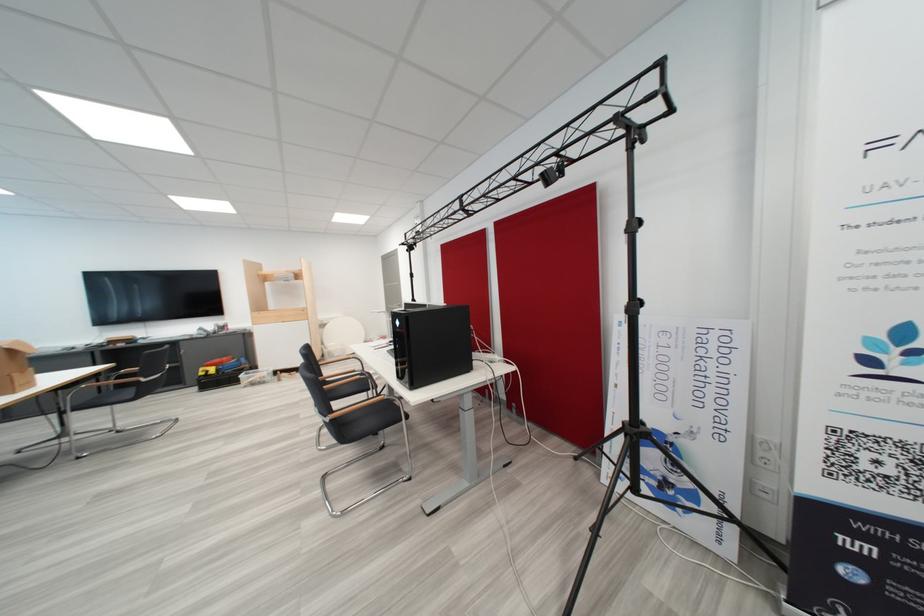
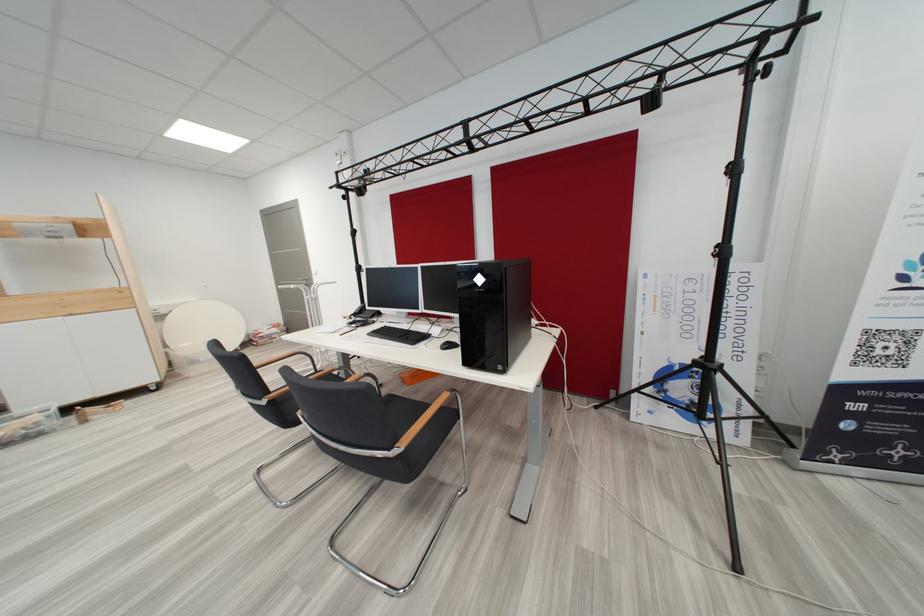
What movement of the cameraman would produce the second image?

The cameraman walked toward left, forward.